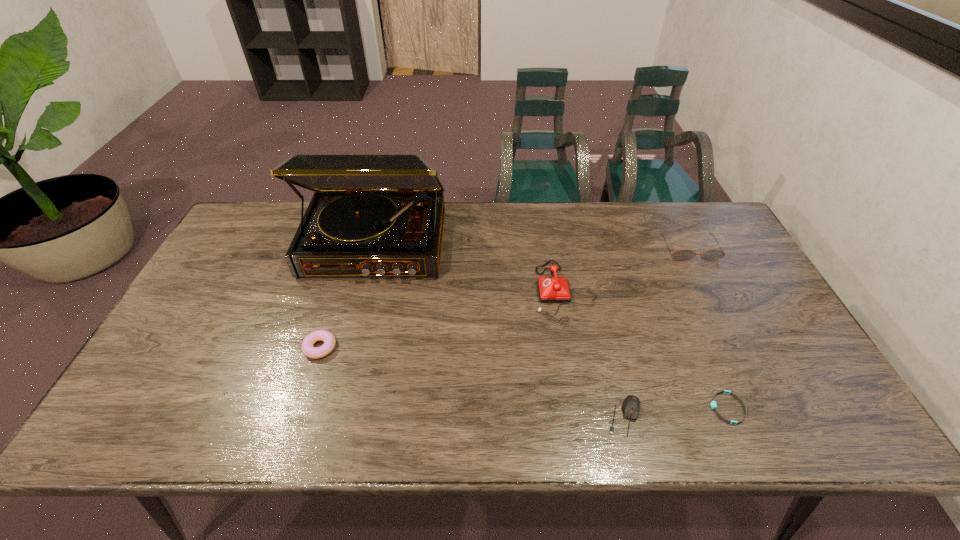
Locate an element on the screen. This screenshot has width=960, height=540. record player is located at coordinates [371, 215].

You are a GUI agent. You are given a task and a screenshot of the screen. Output one action in this format:
    pyautogui.click(x=<x>, y=<y>)
    Task: Click on the second tallest object
    This screenshot has height=540, width=960.
    Given the screenshot: What is the action you would take?
    pyautogui.click(x=551, y=289)

I want to click on the fourth shortest object, so tap(681, 255).

At what (x,y) coordinates should I click in order to perform the action: click on the third shortest object. Please return your answer as a coordinate pair (x, y). This screenshot has width=960, height=540. Looking at the image, I should click on (329, 340).

You are a GUI agent. You are given a task and a screenshot of the screen. Output one action in this format:
    pyautogui.click(x=<x>, y=<y>)
    Task: Click on the third nearest object
    This screenshot has width=960, height=540.
    Given the screenshot: What is the action you would take?
    pyautogui.click(x=329, y=340)

Locate an element on the screen. Image resolution: width=960 pixels, height=540 pixels. the fifth tallest object is located at coordinates (631, 404).

Find the location of a particular element. The height and width of the screenshot is (540, 960). wristband is located at coordinates (713, 404).

This screenshot has width=960, height=540. Find the location of `vacant region located 0.190m on the front-facing side of the tallest object`. vacant region located 0.190m on the front-facing side of the tallest object is located at coordinates (352, 336).

The height and width of the screenshot is (540, 960). In order to click on vacant space located 0.270m on the dial of the telephone in this screenshot , I will do `click(441, 292)`.

The image size is (960, 540). Find the location of `blank area located 0.260m on the dial of the telephone`. blank area located 0.260m on the dial of the telephone is located at coordinates (444, 292).